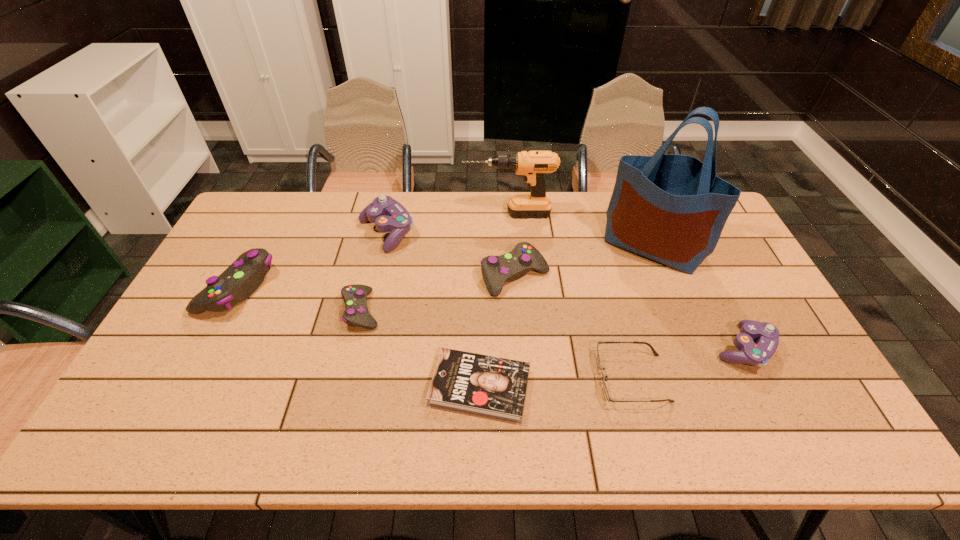
I want to click on free space located 0.340m on the back of the leftmost object, so click(x=286, y=194).

Image resolution: width=960 pixels, height=540 pixels. Identify the location of vacant space situated 0.060m on the left of the rightmost gray control. [x=461, y=276].

Identify the location of vacant space situated on the left of the nearer purple control. Image resolution: width=960 pixels, height=540 pixels. (628, 348).

I want to click on vacant space located on the front of the third shortest object, so click(335, 417).

The height and width of the screenshot is (540, 960). In order to click on vacant space situated 0.390m on the front-facing side of the eighth tallest object in this screenshot , I will do `click(444, 378)`.

Locate an element on the screen. The height and width of the screenshot is (540, 960). vacant space located 0.280m on the front-facing side of the eighth tallest object is located at coordinates (488, 378).

You are a GUI agent. You are given a task and a screenshot of the screen. Output one action in this format:
    pyautogui.click(x=<x>, y=<y>)
    Task: Click on the free space located 0.400m on the front-facing side of the eighth tallest object
    This screenshot has height=540, width=960.
    Given the screenshot: What is the action you would take?
    pyautogui.click(x=441, y=378)

Locate an element on the screen. The height and width of the screenshot is (540, 960). blank area located on the left of the shortest object is located at coordinates (356, 387).

Locate an element on the screen. The width and height of the screenshot is (960, 540). handbag that is positioned at the far edge is located at coordinates (670, 208).

The image size is (960, 540). What are the coordinates of `drill at the far edge` in the screenshot? It's located at pyautogui.click(x=532, y=165).